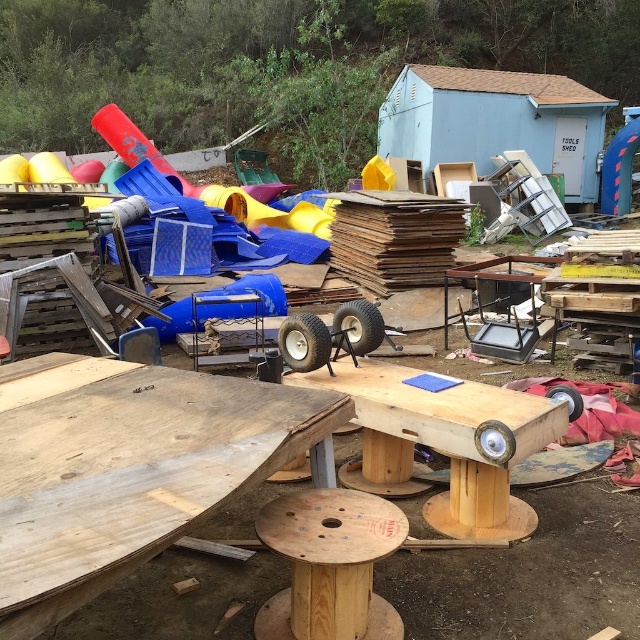
From the picture: Can you confirm if wooden plank at center is positioned above wooden spool at lower center?

Correct, wooden plank at center is located above wooden spool at lower center.

Based on the photo, can you confirm if wooden plank at center is wider than wooden spool at lower center?

Yes.

Is point (257, 387) in front of point (380, 556)?

No, (257, 387) is behind (380, 556).

Image resolution: width=640 pixels, height=640 pixels. I want to click on wooden plank at center, so click(134, 474).

Is wooden spool table at center bigger than brown cardboard at center?

No.

In the scene shown: Does wooden spool table at center have a smaller size compared to brown cardboard at center?

Yes, wooden spool table at center is smaller than brown cardboard at center.

You are a GUI agent. You are given a task and a screenshot of the screen. Output one action in this format:
    pyautogui.click(x=<x>, y=<y>)
    Task: Click on the wooden spool table at center
    This screenshot has height=640, width=640.
    Given the screenshot: What is the action you would take?
    coord(448,442)

Is blue painted wood shed at upper center below wooden spool at lower center?

Incorrect, blue painted wood shed at upper center is not positioned below wooden spool at lower center.

The width and height of the screenshot is (640, 640). I want to click on blue painted wood shed at upper center, so click(x=496, y=122).